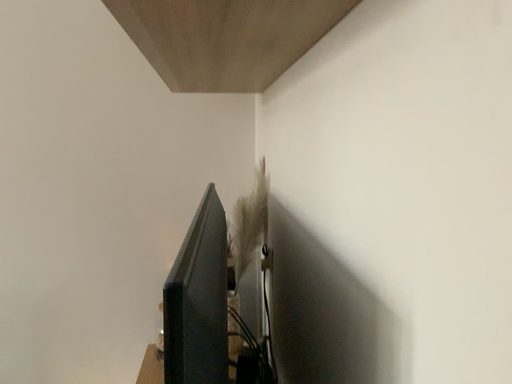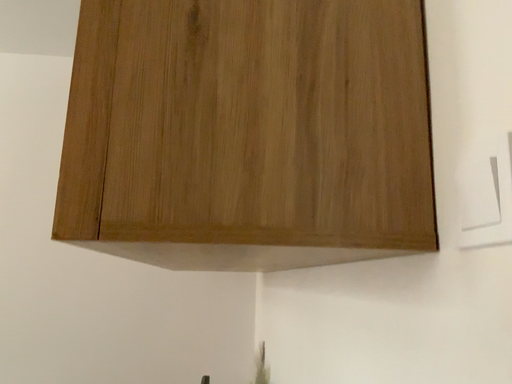
Question: How did the camera likely rotate when shooting the video?

Choices:
 (A) rotated downward
 (B) rotated upward

Answer: (B)